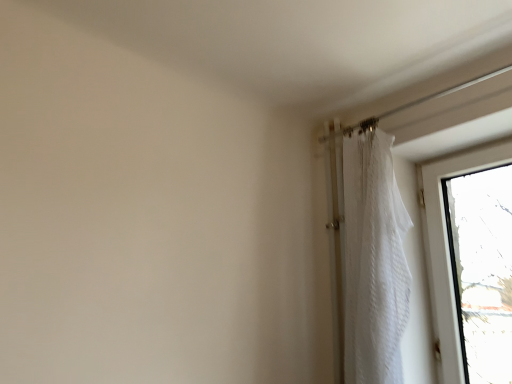
Question: Is transparent glass window at upper right inside or outside of white sheer curtain at upper right?

Choices:
 (A) outside
 (B) inside

Answer: (A)

Question: Relative to white sheer curtain at upper right, is transparent glass window at upper right in front or behind?

Choices:
 (A) front
 (B) behind

Answer: (B)

Question: Visually, is transparent glass window at upper right positioned to the left or to the right of white sheer curtain at upper right?

Choices:
 (A) left
 (B) right

Answer: (B)

Question: From a real-world perspective, relative to transparent glass window at upper right, is white sheer curtain at upper right vertically above or below?

Choices:
 (A) below
 (B) above

Answer: (B)

Question: In terms of height, does white sheer curtain at upper right look taller or shorter compared to transparent glass window at upper right?

Choices:
 (A) tall
 (B) short

Answer: (A)

Question: Is point (346, 266) positioned closer to the camera than point (443, 253)?

Choices:
 (A) closer
 (B) farther

Answer: (A)

Question: Is white sheer curtain at upper right inside or outside of transparent glass window at upper right?

Choices:
 (A) outside
 (B) inside

Answer: (A)